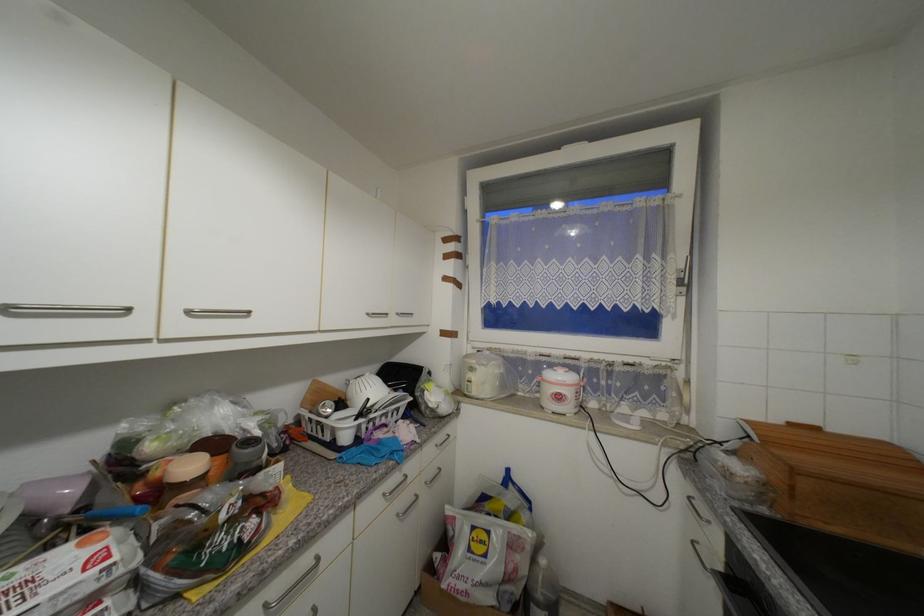
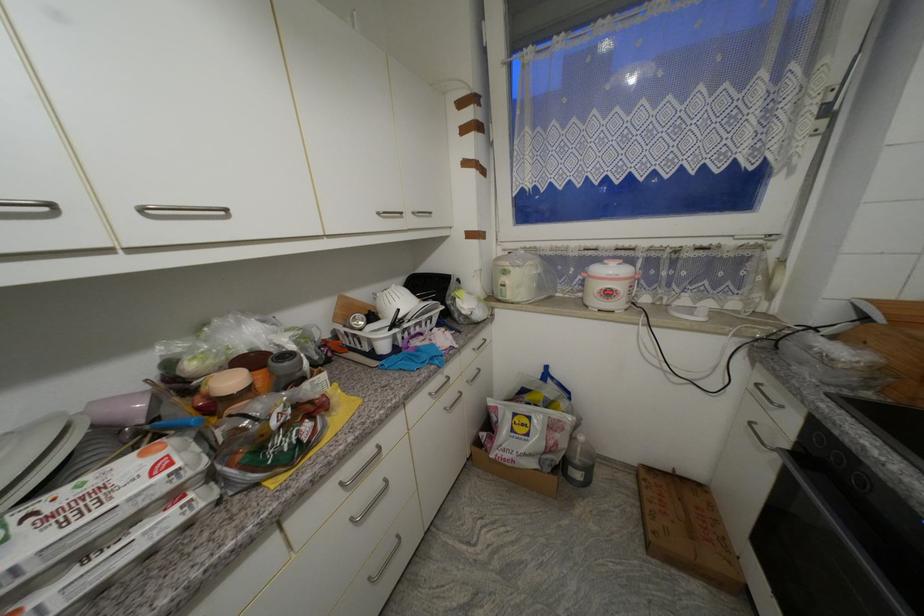
Where in the second image is the point corresponding to point 565,399 from the first image?

(614, 294)